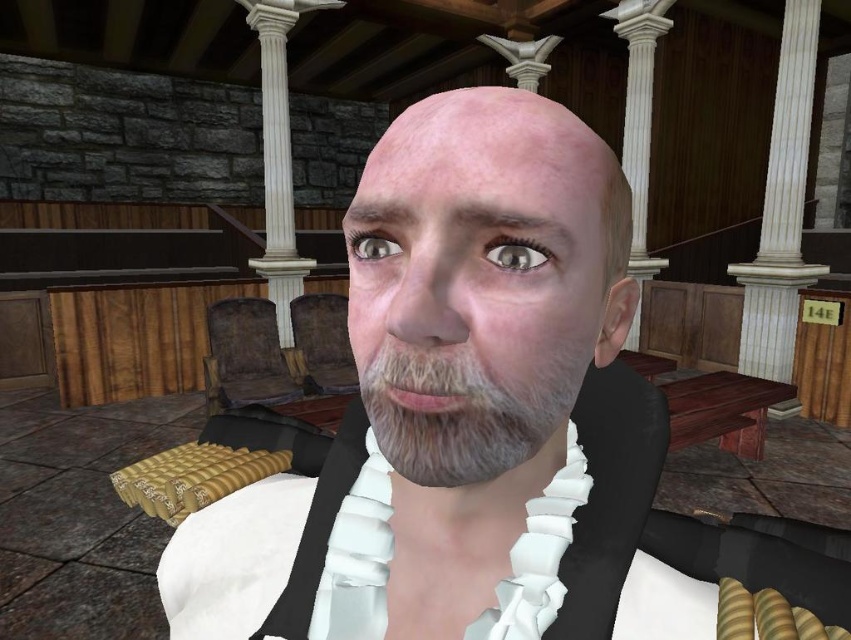
You are a virtual assistant in a game. The game requires you to identify the location of the judge in the courtroom scene. The judge is wearing a black and white robe with a high collar and white cravat. Can you determine if the judge is located at the point marked by the coordinates point (461, 412)?

The point (461, 412) marks graywoollyfuzzybeard at center, so the judge is not located there as the description specifies the judge is wearing a black and white robe with a high collar and white cravat.

You are a forensic analyst examining a digital courtroom image. You need to determine if the shiny gray eye at center is within the standard 10 inch safety zone for closeup analysis. Is it within the zone?

The shiny gray eye at center is 9.61 inches from the camera, which is within the standard 10 inch safety zone for closeup analysis.